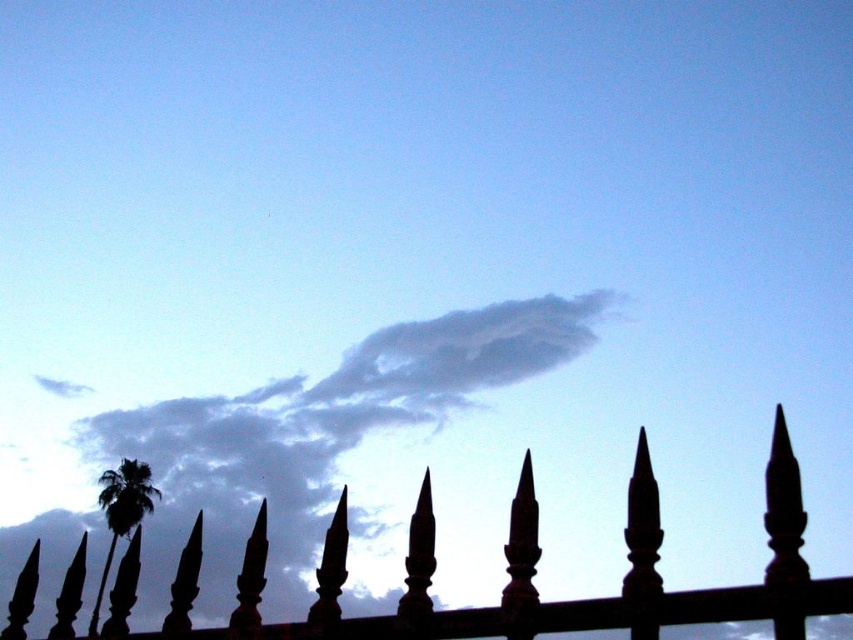
You are an architect designing a new garden. You want to ensure that the black wrought iron fence at center does not block the view of the white fluffy cloud at upper center from the garden. Based on the scene, can you confirm if the fence is narrower than the cloud?

The white fluffy cloud at upper center is wider than the black wrought iron fence at center, so the fence will not block the entire view of the cloud as it is narrower.

You are an artist trying to paint the scene. You want to ensure the white fluffy cloud at upper center and the black wrought iron fence at center are proportionally accurate. Which object should you paint larger?

The white fluffy cloud at upper center should be painted larger since it has a larger size compared to the black wrought iron fence at center.